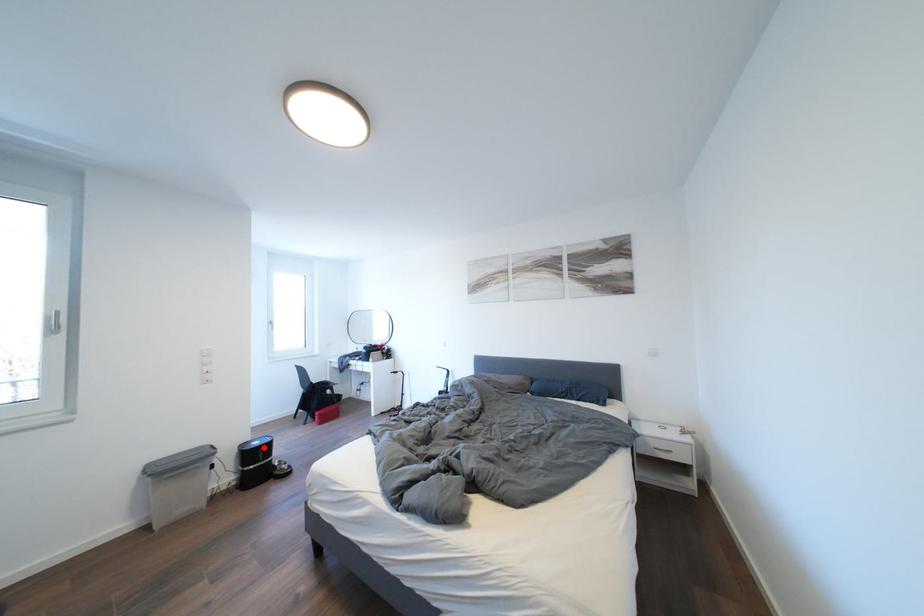
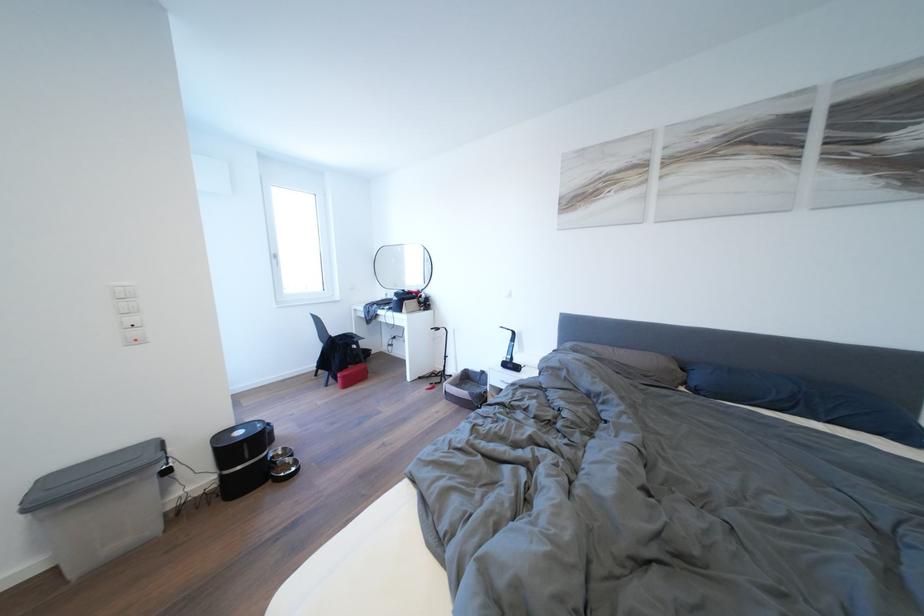
Where in the second image is the point corresponding to the highlighted location from the first image?

(248, 438)